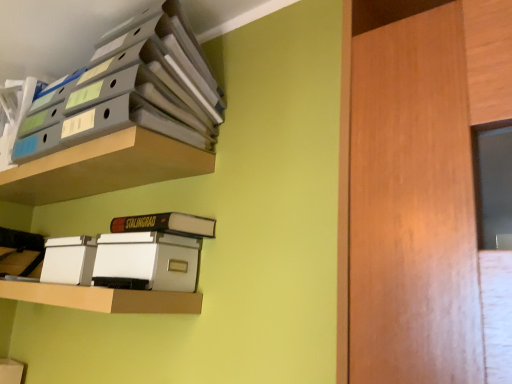
Question: Which direction should I rotate to look at white cardboard shelf at lower center, acting as the 3th shelf starting from the top?

Choices:
 (A) right
 (B) left

Answer: (B)

Question: Is matte plastic shelf at upper left, the 2th shelf viewed from the top, shorter than white plastic storage box at lower left?

Choices:
 (A) no
 (B) yes

Answer: (B)

Question: Does matte plastic shelf at upper left, which ranks as the second shelf in bottom-to-top order, have a smaller size compared to white plastic storage box at lower left?

Choices:
 (A) yes
 (B) no

Answer: (B)

Question: From a real-world perspective, is matte plastic shelf at upper left, the 2th shelf viewed from the top, physically above white plastic storage box at lower left?

Choices:
 (A) no
 (B) yes

Answer: (B)

Question: From the image's perspective, is matte plastic shelf at upper left, the 2th shelf viewed from the top, above white plastic storage box at lower left?

Choices:
 (A) yes
 (B) no

Answer: (A)

Question: Can you confirm if matte plastic shelf at upper left, the 2th shelf viewed from the top, is thinner than white plastic storage box at lower left?

Choices:
 (A) no
 (B) yes

Answer: (A)

Question: Can you confirm if matte plastic shelf at upper left, which ranks as the second shelf in bottom-to-top order, is bigger than white plastic storage box at lower left?

Choices:
 (A) yes
 (B) no

Answer: (A)

Question: Is hardcover book at center bigger than matte plastic shelf at upper left, which ranks as the second shelf in bottom-to-top order?

Choices:
 (A) no
 (B) yes

Answer: (A)

Question: Considering the relative positions of hardcover book at center and matte plastic shelf at upper left, which ranks as the second shelf in bottom-to-top order, in the image provided, is hardcover book at center to the right of matte plastic shelf at upper left, which ranks as the second shelf in bottom-to-top order, from the viewer's perspective?

Choices:
 (A) no
 (B) yes

Answer: (B)

Question: Does hardcover book at center lie in front of matte plastic shelf at upper left, the 2th shelf viewed from the top?

Choices:
 (A) no
 (B) yes

Answer: (A)

Question: Is hardcover book at center located outside matte plastic shelf at upper left, which ranks as the second shelf in bottom-to-top order?

Choices:
 (A) no
 (B) yes

Answer: (B)

Question: Is hardcover book at center looking in the opposite direction of matte plastic shelf at upper left, the 2th shelf viewed from the top?

Choices:
 (A) yes
 (B) no

Answer: (B)

Question: Is hardcover book at center further to camera compared to matte plastic shelf at upper left, which ranks as the second shelf in bottom-to-top order?

Choices:
 (A) yes
 (B) no

Answer: (A)

Question: Could you tell me if matte plastic shelf at upper left, the 2th shelf viewed from the top, is turned towards matte gray folders at upper left, the third shelf from the bottom?

Choices:
 (A) yes
 (B) no

Answer: (B)